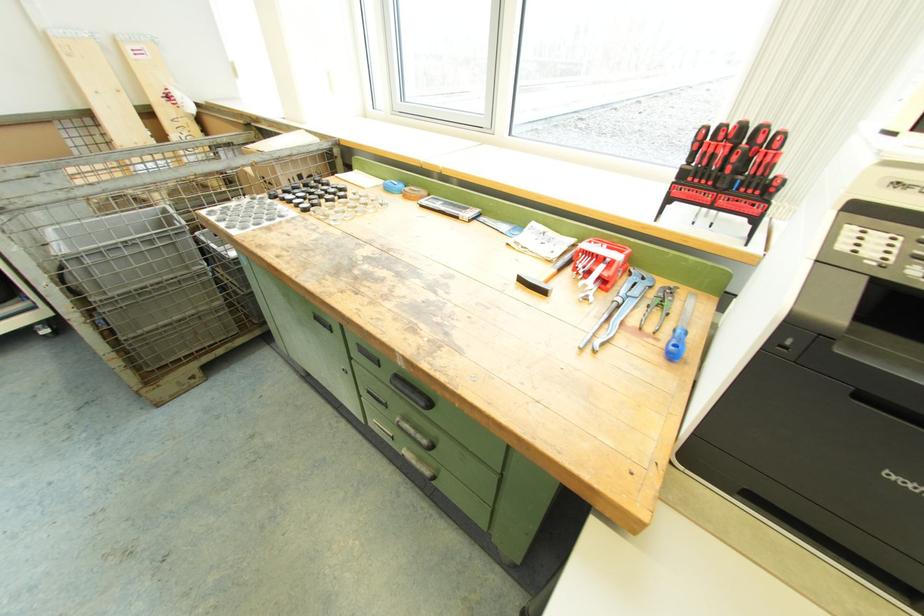
Where is `printer button`? printer button is located at coordinates (869, 245).